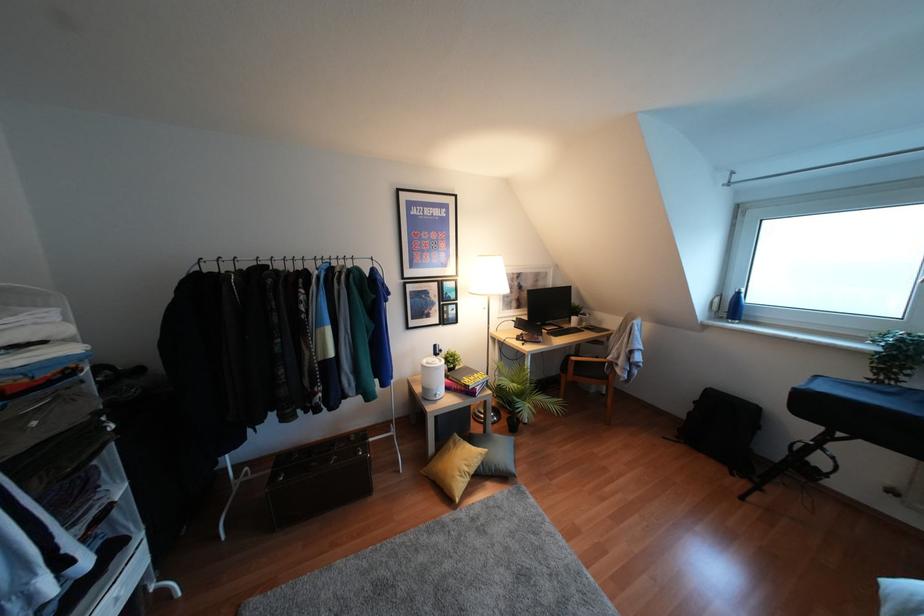
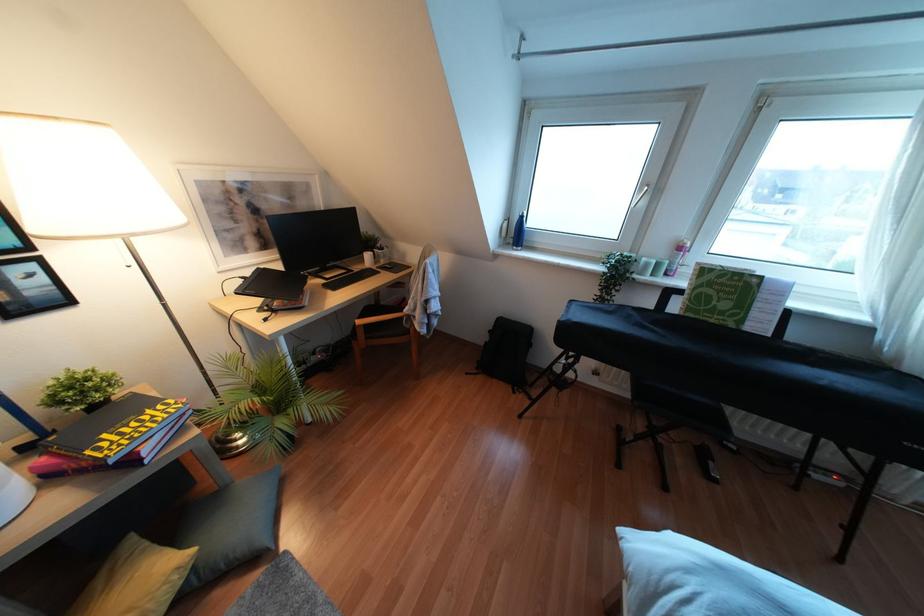
Based on the continuous images, in which direction is the camera rotating?

The camera's rotation is toward right-down.